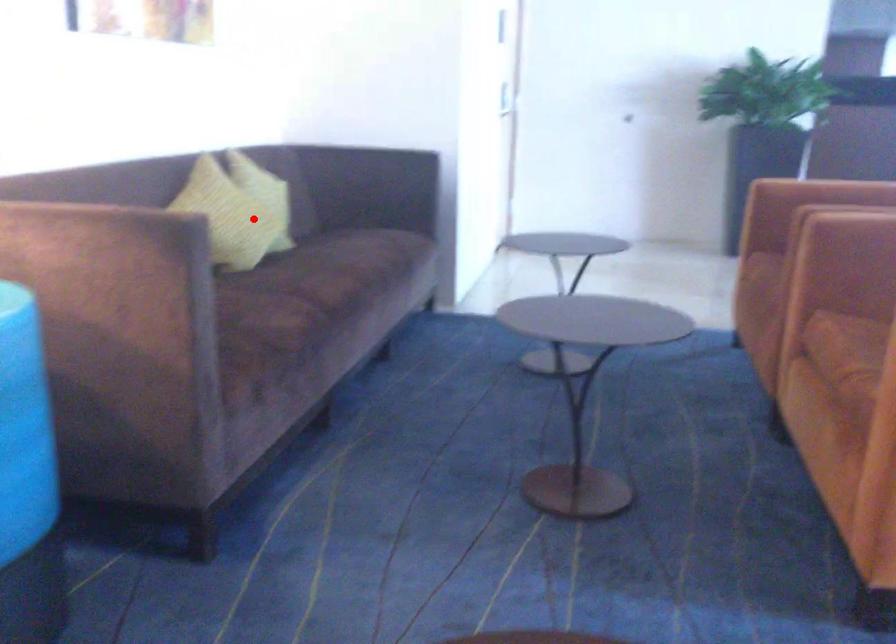
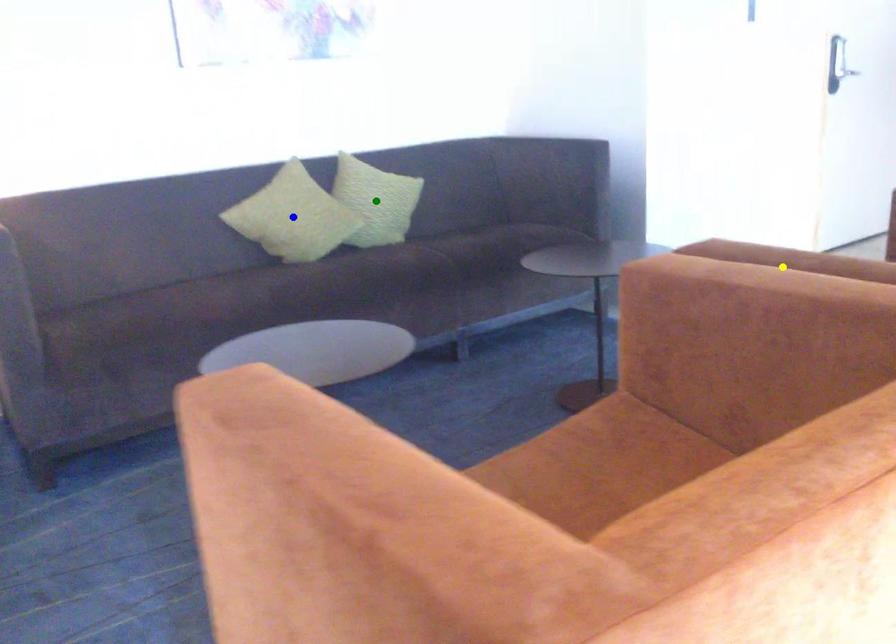
Question: I am providing you with two images of the same scene from different viewpoints. A red point is marked on the first image. You are given multiple points on the second image. Which point in image 2 is actually the same real-world point as the red point in image 1?

Choices:
 (A) yellow point
 (B) blue point
 (C) green point

Answer: (B)